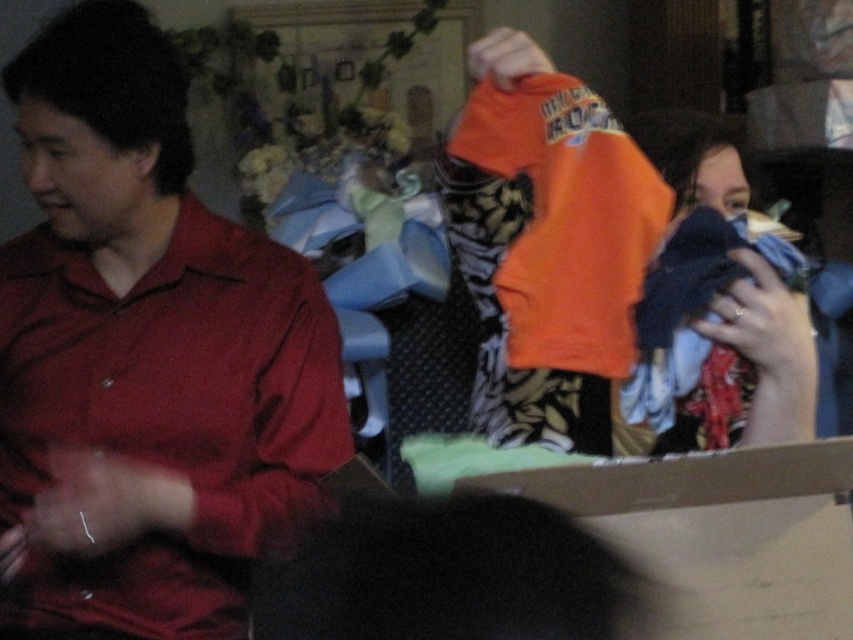
Can you confirm if matte red shirt at left is positioned above orange cotton shirt at right?

No, matte red shirt at left is not above orange cotton shirt at right.

Between matte red shirt at left and orange cotton shirt at right, which one has more height?

matte red shirt at left is taller.

The width and height of the screenshot is (853, 640). Identify the location of matte red shirt at left. (144, 358).

Can you confirm if matte red shirt at left is smaller than cardboard box at center?

Incorrect, matte red shirt at left is not smaller in size than cardboard box at center.

Does point (164, 241) lie in front of point (851, 444)?

No, it is behind (851, 444).

Locate an element on the screen. matte red shirt at left is located at coordinates (144, 358).

Between point (689, 596) and point (755, 275), which one is positioned in front?

Point (689, 596)

Can you confirm if cardboard box at center is taller than orange cotton shirt at right?

Incorrect, cardboard box at center's height is not larger of orange cotton shirt at right's.

Between point (668, 464) and point (807, 388), which one is positioned in front?

Point (668, 464) is in front.

At what (x,y) coordinates should I click in order to perform the action: click on cardboard box at center. Please return your answer as a coordinate pair (x, y). Looking at the image, I should click on (720, 532).